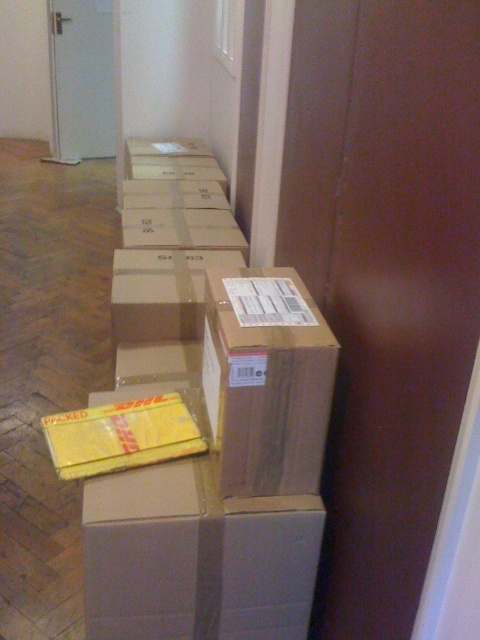
Question: Which point is farther to the camera?

Choices:
 (A) matte cardboard box at center
 (B) brown cardboard box at center

Answer: (A)

Question: Can you confirm if matte cardboard box at center is smaller than brown cardboard box at center?

Choices:
 (A) no
 (B) yes

Answer: (B)

Question: Which of the following is the closest to the observer?

Choices:
 (A) matte cardboard box at center
 (B) brown cardboard box at center

Answer: (B)

Question: Does matte cardboard box at center have a larger size compared to brown cardboard box at center?

Choices:
 (A) no
 (B) yes

Answer: (A)

Question: Is matte cardboard box at center bigger than brown cardboard box at center?

Choices:
 (A) yes
 (B) no

Answer: (B)

Question: Among these objects, which one is farthest from the camera?

Choices:
 (A) brown cardboard box at center
 (B) matte cardboard box at center

Answer: (B)